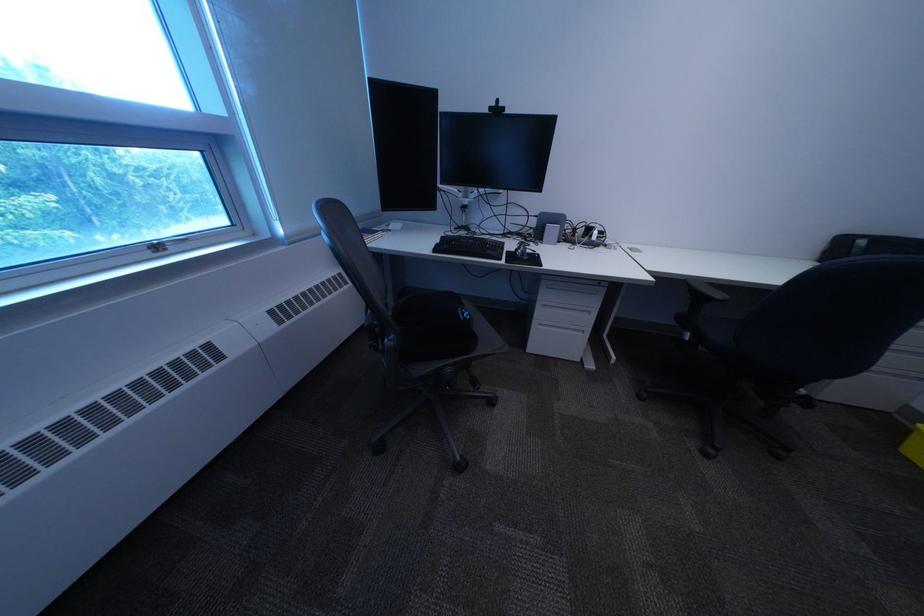
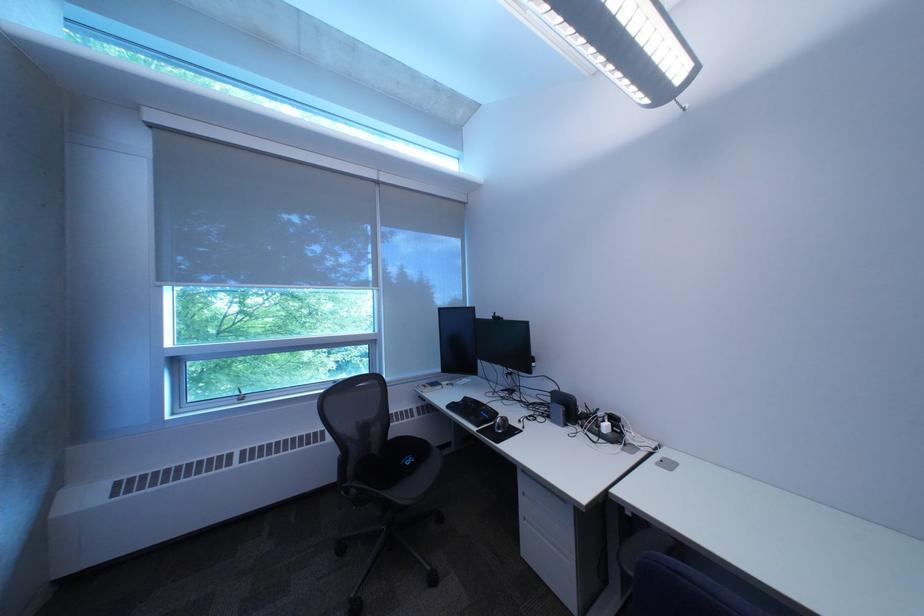
Locate, in the second image, the point that corresponds to (x=213, y=156) in the first image.

(383, 347)